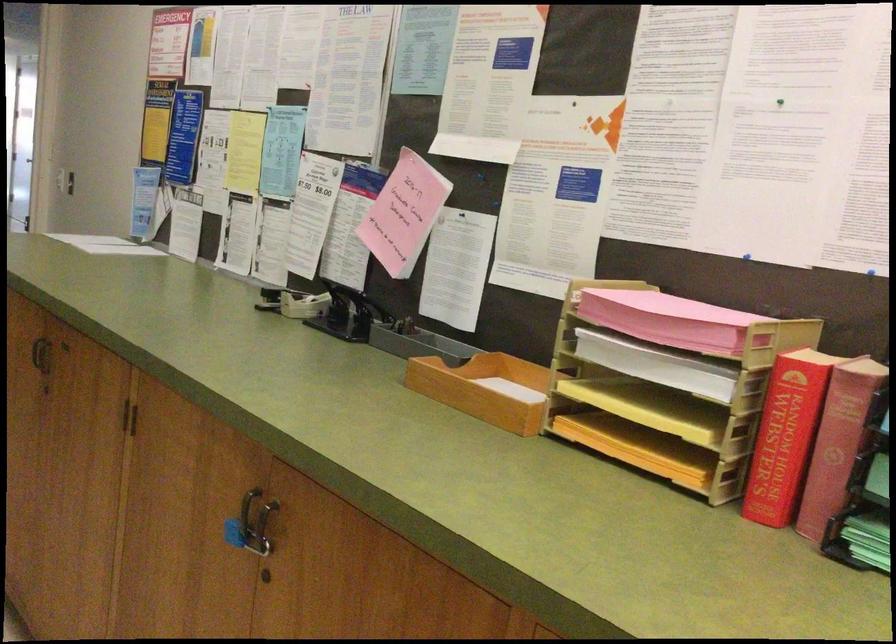
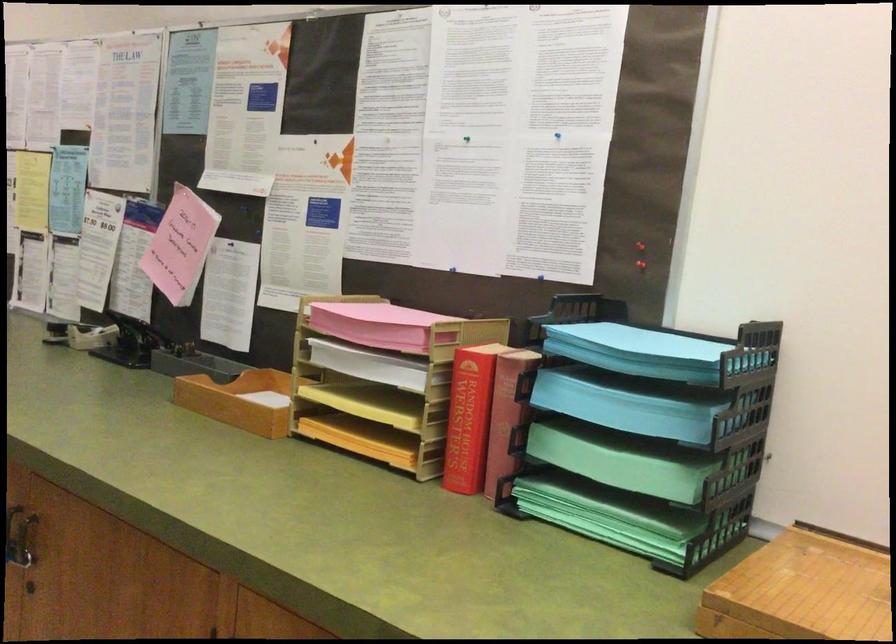
Locate, in the second image, the point that corresponds to pixel 644 406 in the first image.

(367, 404)